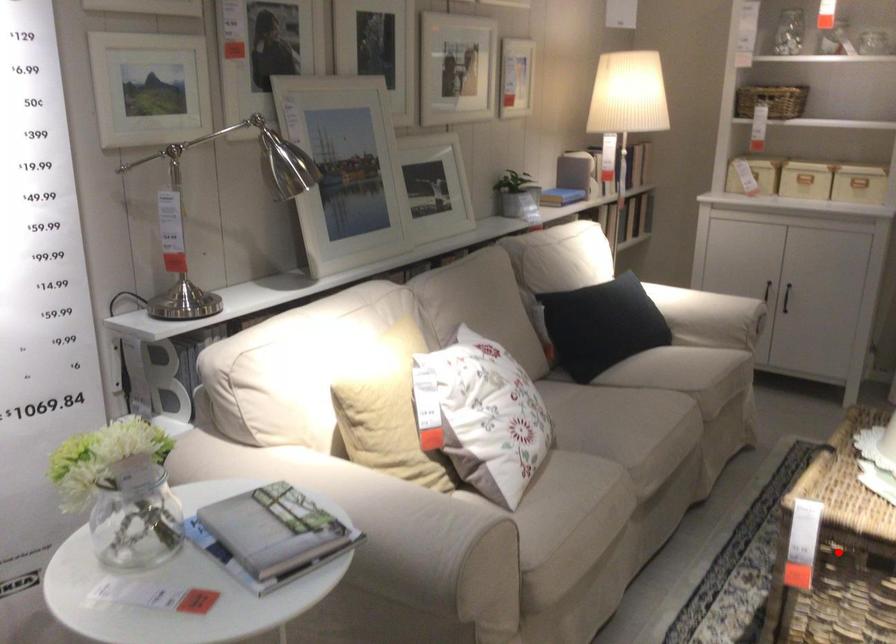
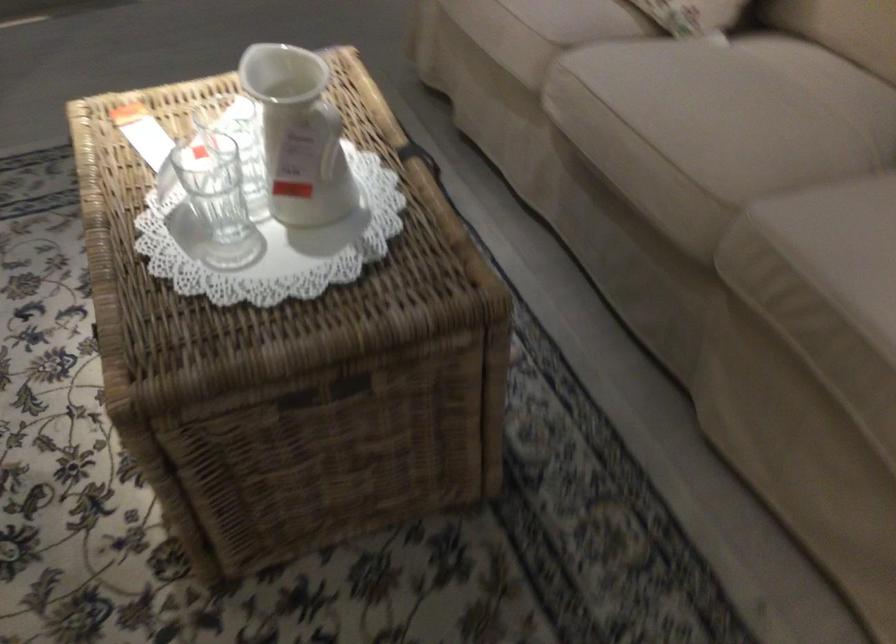
Question: I am providing you with two images of the same scene from different viewpoints. A red point is marked on the first image. At the location where the point appears in image 1, is it still visible in image 2?

Choices:
 (A) Yes
 (B) No

Answer: (B)